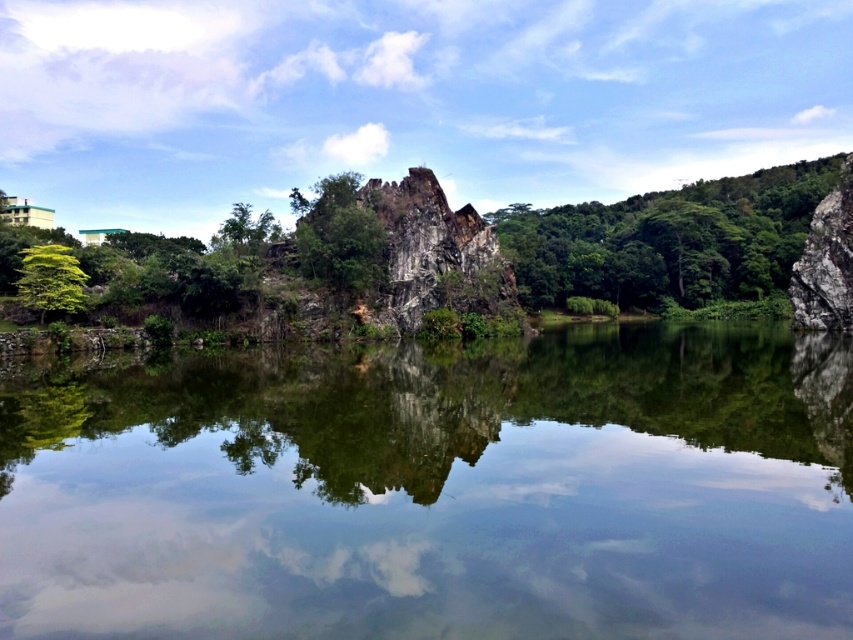
Question: Is green rough rock at center smaller than green leafy tree at left?

Choices:
 (A) yes
 (B) no

Answer: (B)

Question: Which of the following is the closest to the observer?

Choices:
 (A) (393, 456)
 (B) (364, 280)
 (C) (55, 264)

Answer: (A)

Question: Which point is farther to the camera?

Choices:
 (A) green rough rock at center
 (B) green reflective water at center
 (C) green leafy tree at center

Answer: (C)

Question: Does green leafy tree at center lie in front of green leafy tree at left?

Choices:
 (A) yes
 (B) no

Answer: (B)

Question: Does green leafy tree at center have a larger size compared to green rough rock at center?

Choices:
 (A) no
 (B) yes

Answer: (B)

Question: Which object appears farthest from the camera in this image?

Choices:
 (A) green rough rock at center
 (B) green reflective water at center

Answer: (A)